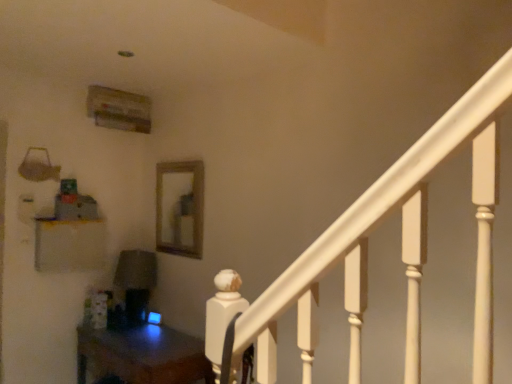
Identify the location of empty space that is ontop of matte white shelf at left (from a real-world perspective). (71, 218).